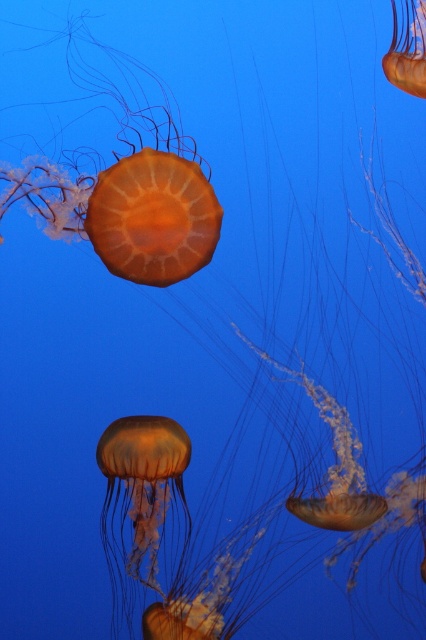
Who is positioned more to the left, translucent orange jellyfish at center or translucent orange jellyfish at upper center?

translucent orange jellyfish at center is more to the left.

Locate an element on the screen. The image size is (426, 640). translucent orange jellyfish at center is located at coordinates (141, 500).

Does point (166, 449) lie in front of point (403, 45)?

That is False.

What are the coordinates of `translucent orange jellyfish at center` in the screenshot? It's located at (141, 500).